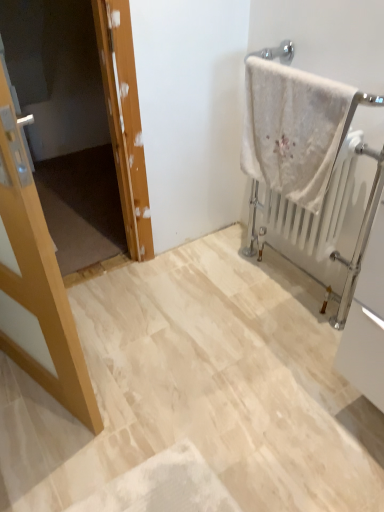
Find the location of `empty space that is in between wooden door at left and white metallic radiator at right`. empty space that is in between wooden door at left and white metallic radiator at right is located at coordinates (199, 290).